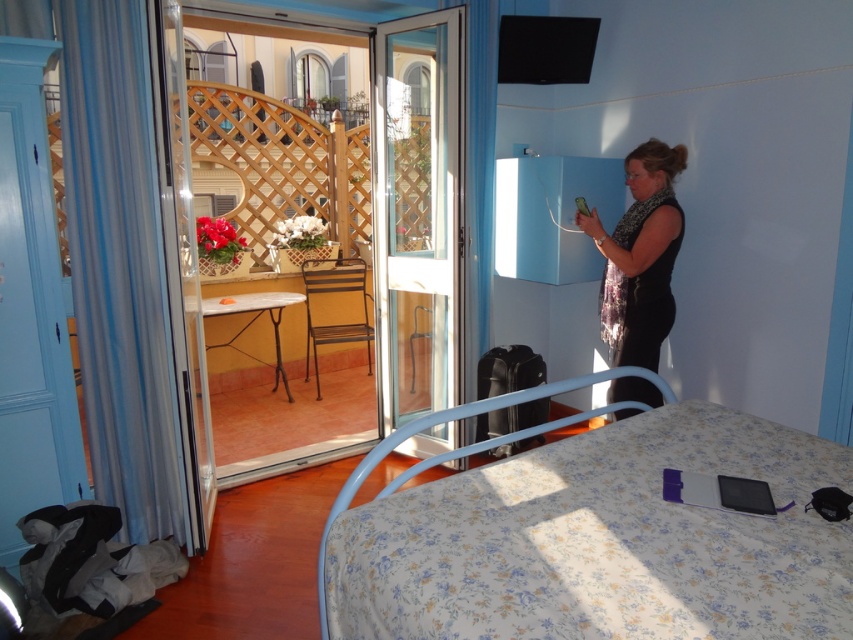
Which is above, transparent glass door at center or black fabric dress at center?

black fabric dress at center

Between point (335, 333) and point (640, 179), which one is positioned in front?

Positioned in front is point (640, 179).

Find the location of a particular element. transparent glass door at center is located at coordinates (347, 250).

Does floral fabric bed at lower center have a smaller size compared to clear glass screen door at center?

Incorrect, floral fabric bed at lower center is not smaller in size than clear glass screen door at center.

Between floral fabric bed at lower center and clear glass screen door at center, which one is positioned higher?

clear glass screen door at center is above.

Between point (747, 632) and point (448, 216), which one is positioned behind?

Point (448, 216)

Identify the location of floral fabric bed at lower center. Image resolution: width=853 pixels, height=640 pixels. (595, 538).

Which is above, floral fabric bed at lower center or transparent glass door at center?

transparent glass door at center is higher up.

Is floral fabric bed at lower center in front of transparent glass door at center?

Yes, it is.

Where is `floral fabric bed at lower center`? This screenshot has height=640, width=853. floral fabric bed at lower center is located at coordinates (595, 538).